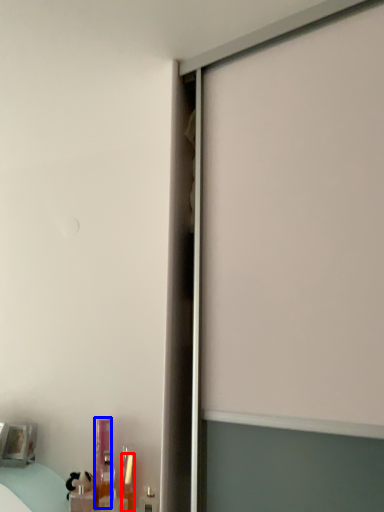
Question: Which point is further to the camera, toiletry (highlighted by a red box) or toiletry (highlighted by a blue box)?

Choices:
 (A) toiletry
 (B) toiletry

Answer: (B)